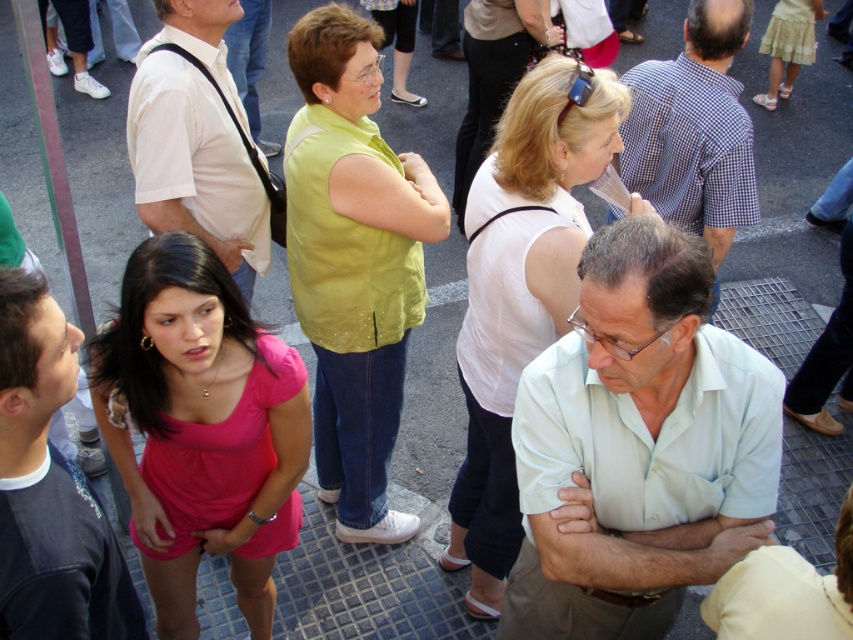
Is the position of light blue shirt at center less distant than that of white matte tank top at center?

Yes.

Between light blue shirt at center and white matte tank top at center, which one appears on the right side from the viewer's perspective?

From the viewer's perspective, light blue shirt at center appears more on the right side.

The width and height of the screenshot is (853, 640). What are the coordinates of `light blue shirt at center` in the screenshot? It's located at (639, 444).

Who is taller, pink fabric dress at center or matte yellow vest at center?

With more height is matte yellow vest at center.

Who is positioned more to the left, pink fabric dress at center or matte yellow vest at center?

pink fabric dress at center is more to the left.

At what (x,y) coordinates should I click in order to perform the action: click on pink fabric dress at center. Please return your answer as a coordinate pair (x, y). Looking at the image, I should click on (202, 428).

Who is taller, light blue shirt at center or matte black shirt at lower left?

With more height is light blue shirt at center.

Between point (566, 348) and point (67, 611), which one is positioned in front?

Point (67, 611) is more forward.

You are a GUI agent. You are given a task and a screenshot of the screen. Output one action in this format:
    pyautogui.click(x=<x>, y=<y>)
    Task: Click on the light blue shirt at center
    
    Given the screenshot: What is the action you would take?
    pyautogui.click(x=639, y=444)